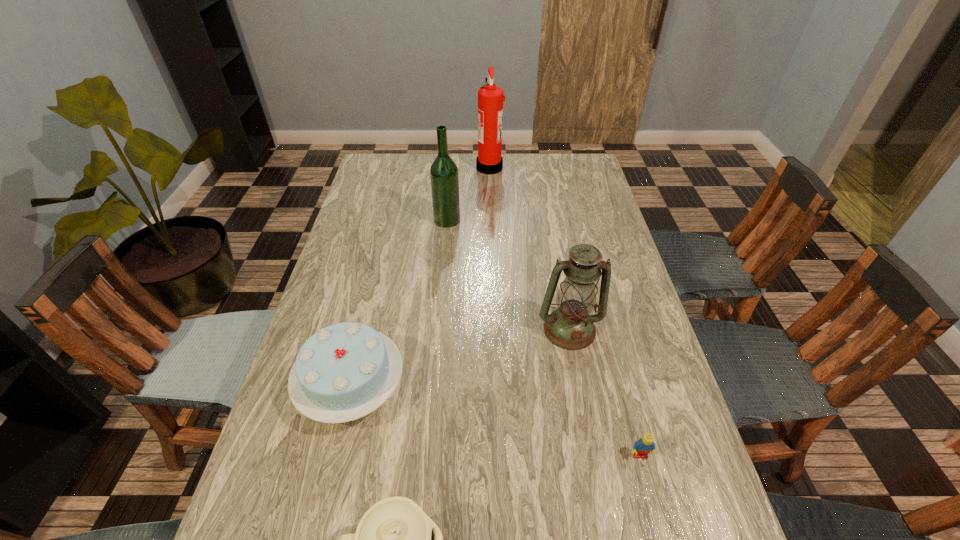
Where is `the fourth object from left to right`? the fourth object from left to right is located at coordinates (490, 98).

Locate an element on the screen. The image size is (960, 540). fire extinguisher is located at coordinates (490, 98).

Find the location of a particular element. alcohol is located at coordinates (444, 176).

Find the location of a particular element. The image size is (960, 540). oil lamp is located at coordinates (570, 326).

Find the location of a particular element. The width and height of the screenshot is (960, 540). birthday cake is located at coordinates (343, 372).

Identify the location of Lego. The width and height of the screenshot is (960, 540). (645, 445).

What are the coordinates of `the shortest object` in the screenshot? It's located at (645, 445).

Identify the location of free space located 0.400m with the nozzle aimed from the farthest object. The height and width of the screenshot is (540, 960). (377, 167).

Locate an element on the screen. free space located 0.300m with the nozzle aimed from the farthest object is located at coordinates (402, 167).

This screenshot has width=960, height=540. What are the coordinates of `vacant area situated 0.320m with the nozzle aimed from the farthest object` in the screenshot? It's located at (397, 167).